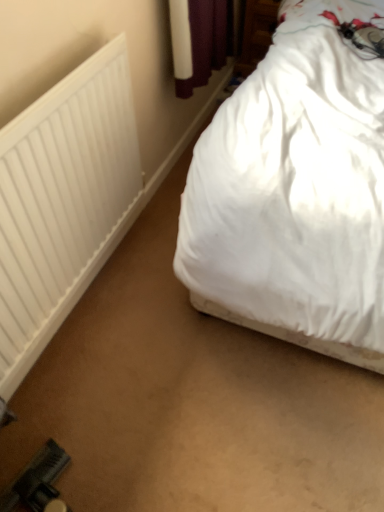
Question: Is white soft bed at upper right positioned with its back to white matte radiator at left?

Choices:
 (A) yes
 (B) no

Answer: (B)

Question: Is the depth of white soft bed at upper right less than that of white matte radiator at left?

Choices:
 (A) yes
 (B) no

Answer: (A)

Question: Considering the relative sizes of white soft bed at upper right and white matte radiator at left in the image provided, is white soft bed at upper right smaller than white matte radiator at left?

Choices:
 (A) no
 (B) yes

Answer: (A)

Question: Does white soft bed at upper right have a lesser height compared to white matte radiator at left?

Choices:
 (A) yes
 (B) no

Answer: (B)

Question: Can you confirm if white soft bed at upper right is positioned to the left of white matte radiator at left?

Choices:
 (A) yes
 (B) no

Answer: (B)

Question: Considering the relative sizes of white soft bed at upper right and white matte radiator at left in the image provided, is white soft bed at upper right thinner than white matte radiator at left?

Choices:
 (A) yes
 (B) no

Answer: (B)

Question: From a real-world perspective, is white matte radiator at left over white soft bed at upper right?

Choices:
 (A) yes
 (B) no

Answer: (B)

Question: From a real-world perspective, is white matte radiator at left below white soft bed at upper right?

Choices:
 (A) no
 (B) yes

Answer: (B)

Question: Considering the relative sizes of white matte radiator at left and white soft bed at upper right in the image provided, is white matte radiator at left thinner than white soft bed at upper right?

Choices:
 (A) no
 (B) yes

Answer: (B)

Question: From the image's perspective, is white matte radiator at left beneath white soft bed at upper right?

Choices:
 (A) no
 (B) yes

Answer: (B)

Question: Is the depth of white matte radiator at left less than that of white soft bed at upper right?

Choices:
 (A) no
 (B) yes

Answer: (A)

Question: Does white matte radiator at left have a greater width compared to white soft bed at upper right?

Choices:
 (A) no
 (B) yes

Answer: (A)

Question: Considering the positions of point (54, 246) and point (319, 37), is point (54, 246) closer or farther from the camera than point (319, 37)?

Choices:
 (A) farther
 (B) closer

Answer: (B)